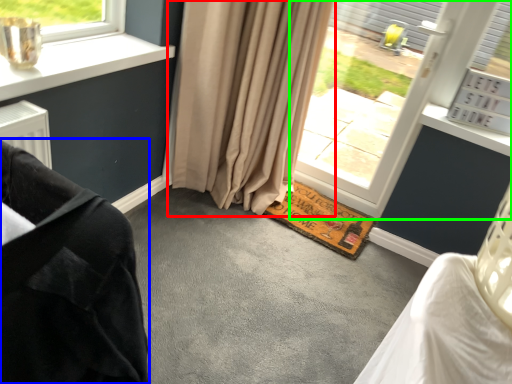
Question: Which object is the farthest from curtain (highlighted by a red box)? Choose among these: furniture (highlighted by a blue box) or window (highlighted by a green box).

Choices:
 (A) furniture
 (B) window

Answer: (A)